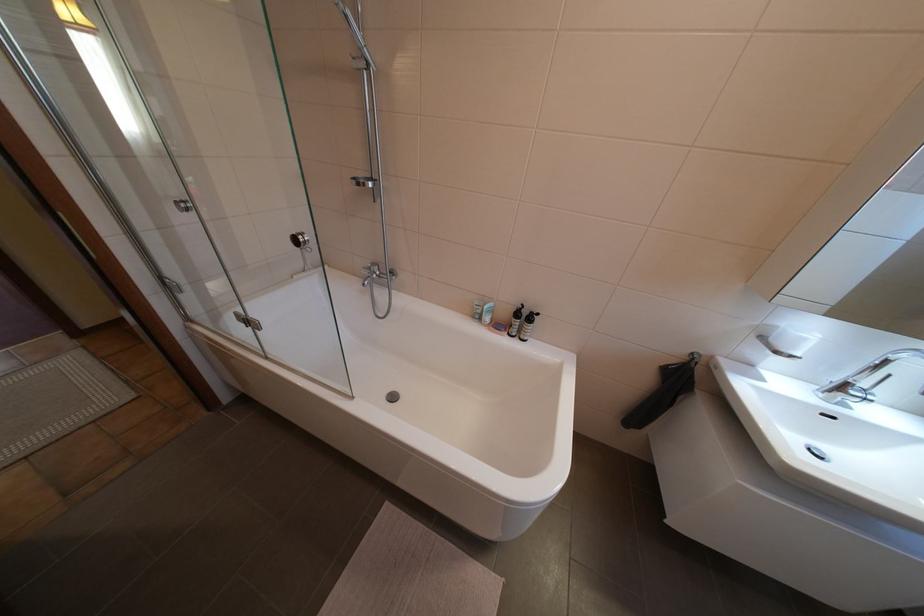
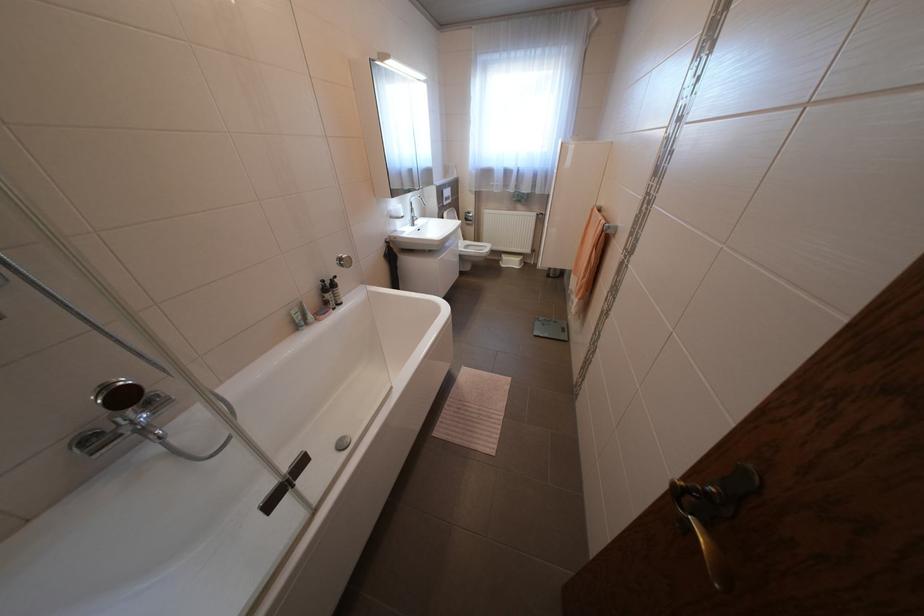
Find the pixel in the second image that matches the point at 490,310 in the first image.

(310, 315)